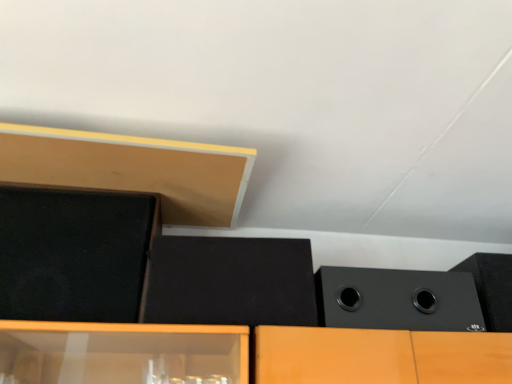
Question: Is black matte speaker at upper right, the first speaker when ordered from right to left, positioned in front of black matte speaker at right, which is the 3th speaker in left-to-right order?

Choices:
 (A) no
 (B) yes

Answer: (A)

Question: Is black matte speaker at upper right, the first speaker when ordered from right to left, at the left side of black matte speaker at right, arranged as the second speaker when viewed from the right?

Choices:
 (A) yes
 (B) no

Answer: (B)

Question: Does black matte speaker at upper right, which is counted as the fourth speaker, starting from the left, have a greater width compared to black matte speaker at right, which is the 3th speaker in left-to-right order?

Choices:
 (A) yes
 (B) no

Answer: (A)

Question: Does black matte speaker at upper right, which is counted as the fourth speaker, starting from the left, have a greater height compared to black matte speaker at right, arranged as the second speaker when viewed from the right?

Choices:
 (A) no
 (B) yes

Answer: (B)

Question: Is black matte speaker at upper right, the first speaker when ordered from right to left, not inside black matte speaker at right, which is the 3th speaker in left-to-right order?

Choices:
 (A) no
 (B) yes

Answer: (B)

Question: Does point (230, 286) appear closer or farther from the camera than point (14, 311)?

Choices:
 (A) farther
 (B) closer

Answer: (A)

Question: Is black matte speaker at center, which appears as the third speaker when viewed from the right, taller or shorter than matte black speaker at upper left, positioned as the first speaker in left-to-right order?

Choices:
 (A) tall
 (B) short

Answer: (B)

Question: Looking at their shapes, would you say black matte speaker at center, the second speaker from the left, is wider or thinner than matte black speaker at upper left, positioned as the first speaker in left-to-right order?

Choices:
 (A) thin
 (B) wide

Answer: (B)

Question: In the image, is black matte speaker at center, which appears as the third speaker when viewed from the right, positioned in front of or behind matte black speaker at upper left, positioned as the first speaker in left-to-right order?

Choices:
 (A) behind
 (B) front

Answer: (A)

Question: Is matte wood at upper left to the left or to the right of black matte speaker at center, which appears as the third speaker when viewed from the right, in the image?

Choices:
 (A) right
 (B) left

Answer: (B)

Question: Is matte wood at upper left in front of or behind black matte speaker at center, the second speaker from the left, in the image?

Choices:
 (A) behind
 (B) front

Answer: (B)

Question: Is matte wood at upper left wider or thinner than black matte speaker at center, the second speaker from the left?

Choices:
 (A) thin
 (B) wide

Answer: (B)

Question: Considering the positions of matte wood at upper left and black matte speaker at center, the second speaker from the left, in the image, is matte wood at upper left bigger or smaller than black matte speaker at center, the second speaker from the left,?

Choices:
 (A) small
 (B) big

Answer: (B)

Question: Considering the relative positions of black matte speaker at right, arranged as the second speaker when viewed from the right, and matte black speaker at upper left, positioned as the first speaker in left-to-right order, in the image provided, is black matte speaker at right, arranged as the second speaker when viewed from the right, to the left or to the right of matte black speaker at upper left, positioned as the first speaker in left-to-right order,?

Choices:
 (A) left
 (B) right

Answer: (B)

Question: In terms of width, does black matte speaker at right, arranged as the second speaker when viewed from the right, look wider or thinner when compared to matte black speaker at upper left, positioned as the first speaker in left-to-right order?

Choices:
 (A) thin
 (B) wide

Answer: (B)